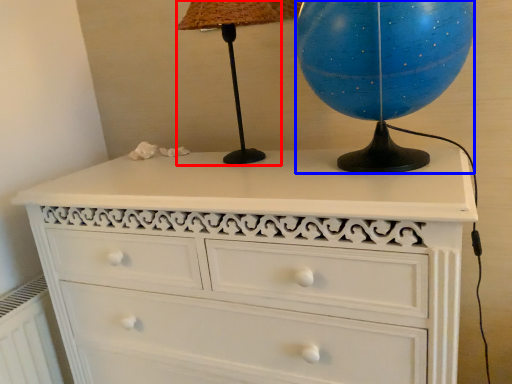
Question: Which of the following is the closest to the observer, table lamp (highlighted by a red box) or sphere (highlighted by a blue box)?

Choices:
 (A) table lamp
 (B) sphere

Answer: (B)